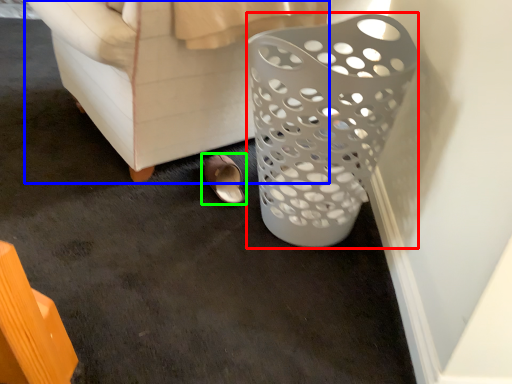
Question: Which object is positioned closest to basket (highlighted by a red box)? Select from furniture (highlighted by a blue box) and footwear (highlighted by a green box).

Choices:
 (A) furniture
 (B) footwear

Answer: (A)